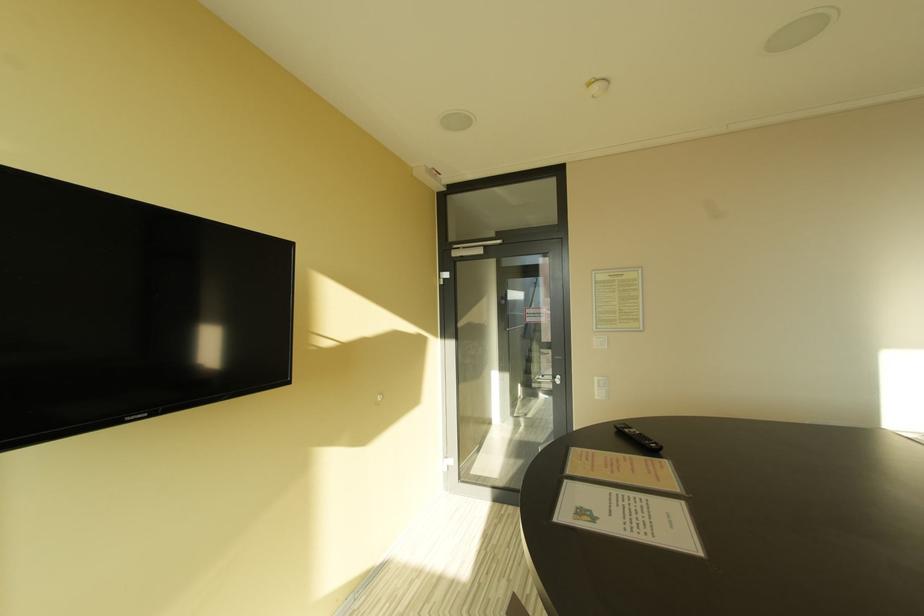
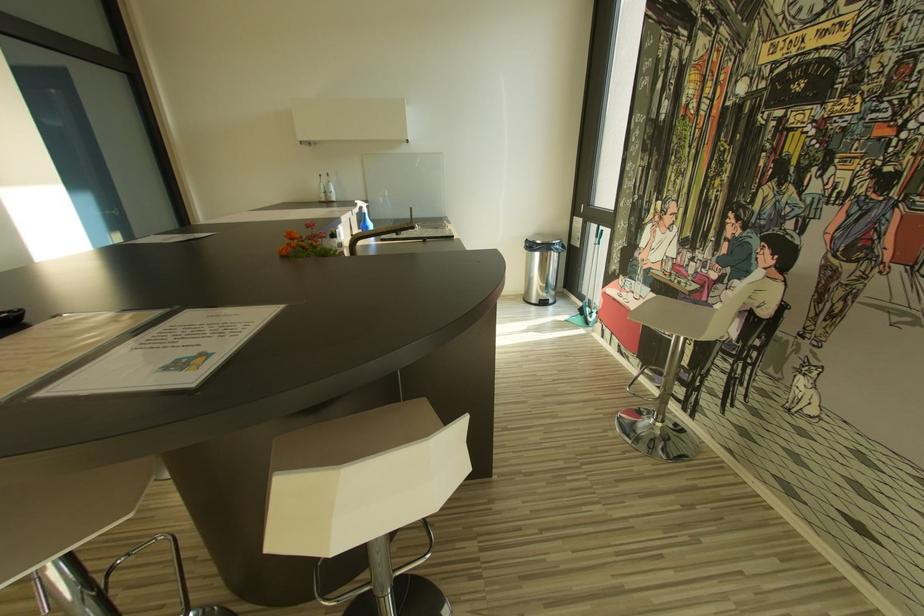
The images are taken continuously from a first-person perspective. In which direction is your viewpoint rotating?

The rotation direction of the camera is right-down.